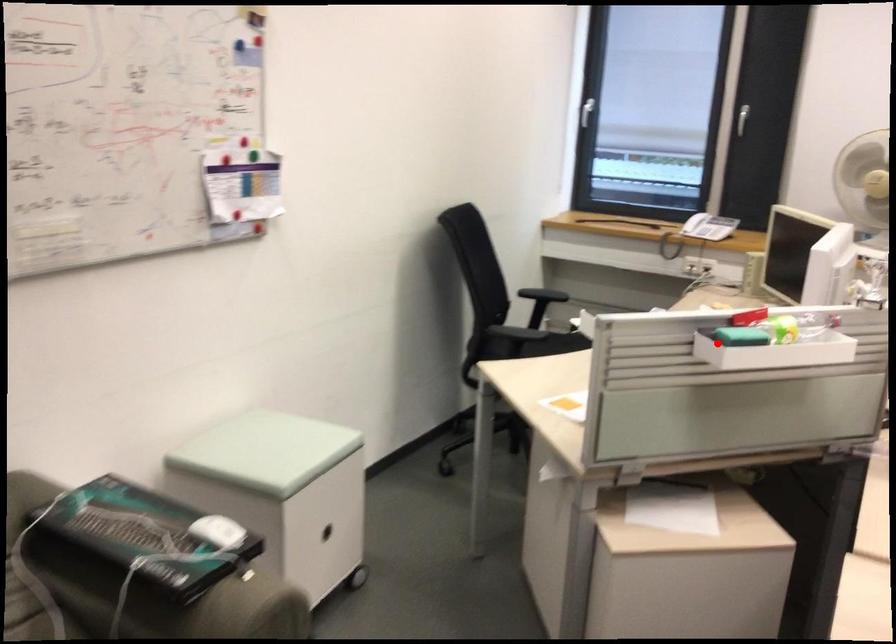
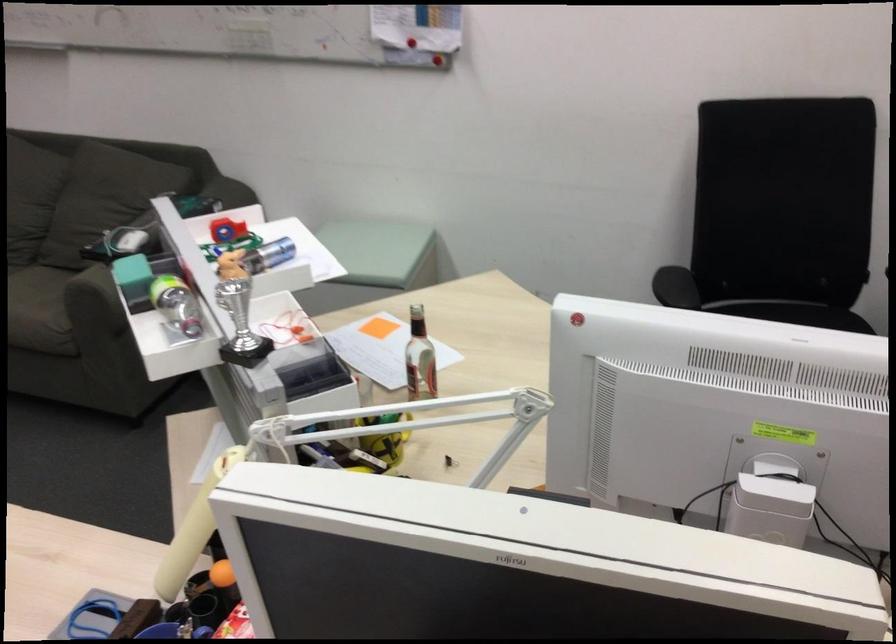
Question: I am providing you with two images of the same scene from different viewpoints. In image1, a red point is highlighted. Considering the same 3D point in image2, which of the following is correct?

Choices:
 (A) It is closer
 (B) It is farther

Answer: (A)